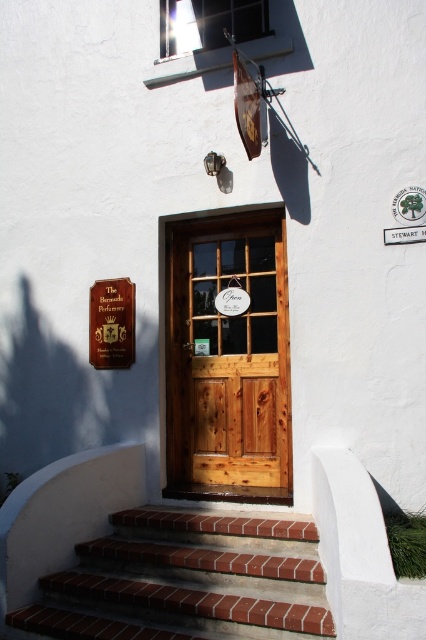
You are standing at the entrance of The Bermuda Perfumery and notice two points marked on the wall. The first point is at coordinates point [178,273] and the second at point [127,349]. From your perspective, which point is closer to you?

Point [127,349] is closer to you because point [178,273] is behind it.

You are standing at the entrance of The Bermuda Perfumery and see two points marked on the wall. The first point is at coordinates point (x=287, y=285) and the second at point (x=264, y=528). From your perspective, which point is closer to you?

Point (x=264, y=528) is closer to you because it is in front of point (x=287, y=285).